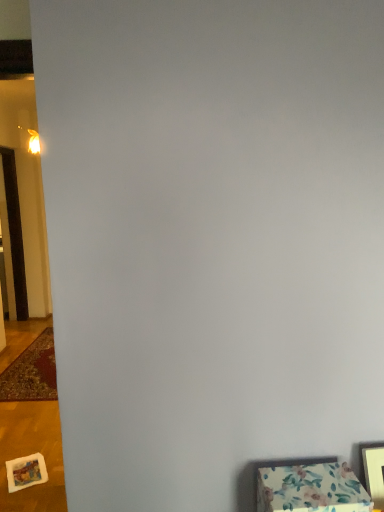
Question: Can you confirm if brown wooden door at left is taller than wooden picture frame at lower right?

Choices:
 (A) no
 (B) yes

Answer: (B)

Question: Is brown wooden door at left oriented away from wooden picture frame at lower right?

Choices:
 (A) yes
 (B) no

Answer: (B)

Question: Can we say brown wooden door at left lies outside wooden picture frame at lower right?

Choices:
 (A) yes
 (B) no

Answer: (A)

Question: Are brown wooden door at left and wooden picture frame at lower right making contact?

Choices:
 (A) yes
 (B) no

Answer: (B)

Question: Is there a large distance between brown wooden door at left and wooden picture frame at lower right?

Choices:
 (A) yes
 (B) no

Answer: (A)

Question: Is brown wooden door at left at the right side of wooden picture frame at lower right?

Choices:
 (A) no
 (B) yes

Answer: (A)

Question: Can you confirm if wooden picture frame at lower right is smaller than carpeted mat at left?

Choices:
 (A) no
 (B) yes

Answer: (B)

Question: Can you confirm if wooden picture frame at lower right is shorter than carpeted mat at left?

Choices:
 (A) no
 (B) yes

Answer: (A)

Question: Can you see wooden picture frame at lower right touching carpeted mat at left?

Choices:
 (A) yes
 (B) no

Answer: (B)

Question: Is wooden picture frame at lower right turned away from carpeted mat at left?

Choices:
 (A) yes
 (B) no

Answer: (B)

Question: Is wooden picture frame at lower right aimed at carpeted mat at left?

Choices:
 (A) no
 (B) yes

Answer: (A)

Question: From a real-world perspective, is wooden picture frame at lower right beneath carpeted mat at left?

Choices:
 (A) no
 (B) yes

Answer: (A)

Question: Considering the relative sizes of carpeted mat at left and floral fabric ottoman at lower right in the image provided, is carpeted mat at left thinner than floral fabric ottoman at lower right?

Choices:
 (A) yes
 (B) no

Answer: (B)